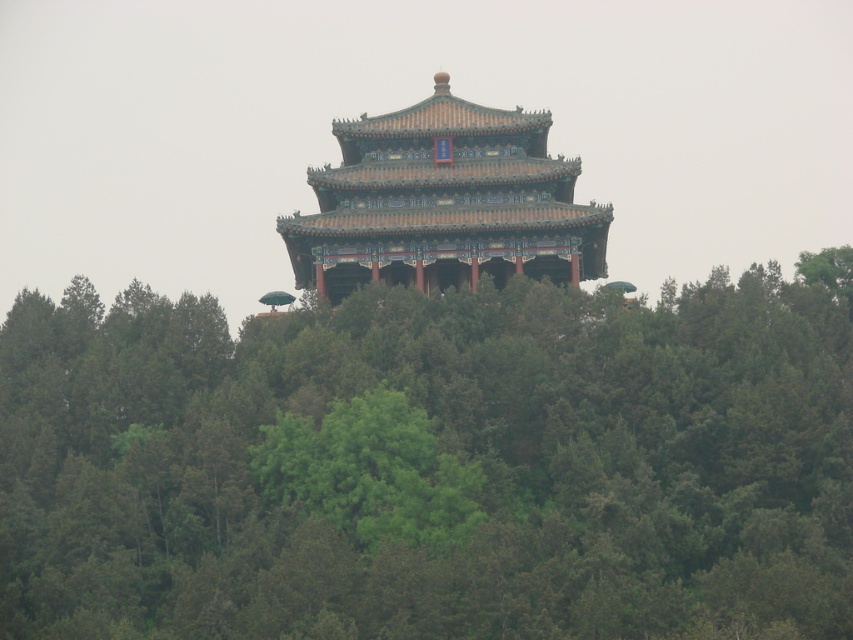
Between green leafy tree at center and shiny orange pagoda at center, which one has less height?

shiny orange pagoda at center

Between point (236, 371) and point (451, 232), which one is positioned behind?

The point (451, 232) is more distant.

At what (x,y) coordinates should I click in order to perform the action: click on green leafy tree at center. Please return your answer as a coordinate pair (x, y). Looking at the image, I should click on (432, 464).